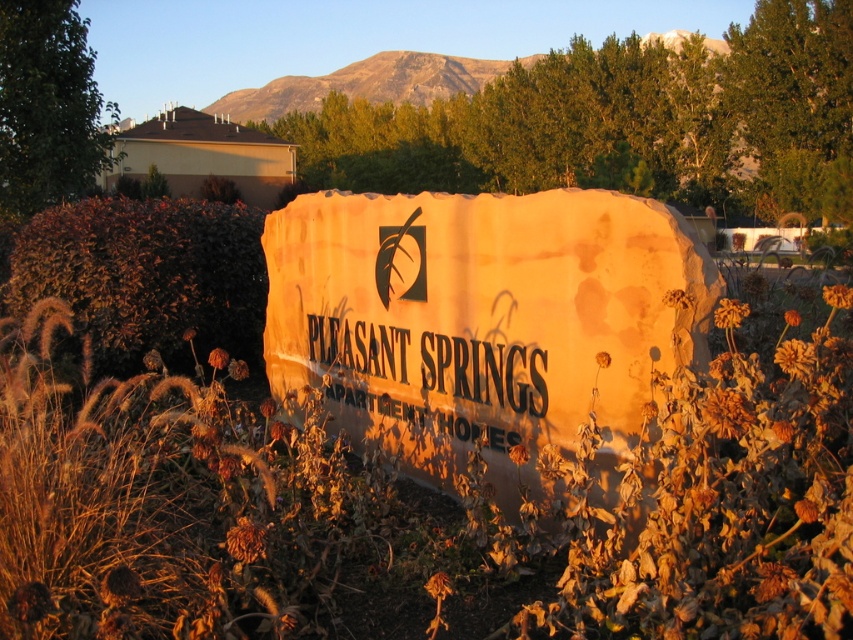
Question: Which of these objects is positioned closest to the matte stone sign at center?

Choices:
 (A) black stone sign at center
 (B) brown dried flower at center

Answer: (A)

Question: Does matte stone sign at center have a smaller size compared to black stone sign at center?

Choices:
 (A) yes
 (B) no

Answer: (B)

Question: Is matte stone sign at center smaller than black stone sign at center?

Choices:
 (A) no
 (B) yes

Answer: (A)

Question: Does brown dried flower at center have a larger size compared to black stone sign at center?

Choices:
 (A) no
 (B) yes

Answer: (B)

Question: Estimate the real-world distances between objects in this image. Which object is farther from the brown dried flower at center?

Choices:
 (A) black stone sign at center
 (B) matte stone sign at center

Answer: (A)

Question: Based on their relative distances, which object is nearer to the black stone sign at center?

Choices:
 (A) brown dried flower at center
 (B) matte stone sign at center

Answer: (B)